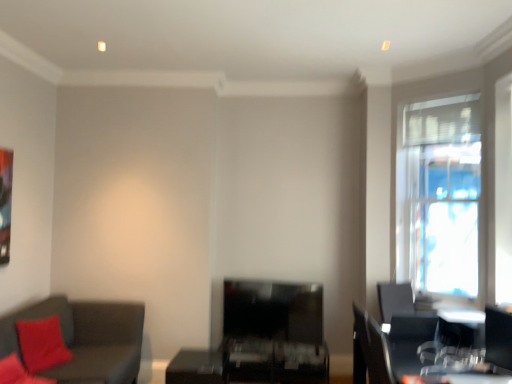
Question: From a real-world perspective, is matte black table at center on dark gray fabric couch at lower left?

Choices:
 (A) yes
 (B) no

Answer: (B)

Question: Is matte black table at center smaller than dark gray fabric couch at lower left?

Choices:
 (A) yes
 (B) no

Answer: (A)

Question: Would you say matte black table at center contains dark gray fabric couch at lower left?

Choices:
 (A) no
 (B) yes

Answer: (A)

Question: From a real-world perspective, is matte black table at center physically below dark gray fabric couch at lower left?

Choices:
 (A) no
 (B) yes

Answer: (B)

Question: Considering the relative sizes of matte black table at center and dark gray fabric couch at lower left in the image provided, is matte black table at center shorter than dark gray fabric couch at lower left?

Choices:
 (A) no
 (B) yes

Answer: (B)

Question: Does matte black table at center turn towards dark gray fabric couch at lower left?

Choices:
 (A) yes
 (B) no

Answer: (B)

Question: From a real-world perspective, is black plastic swivel chair at lower right positioned over dark gray fabric couch at lower left based on gravity?

Choices:
 (A) yes
 (B) no

Answer: (A)

Question: Are black plastic swivel chair at lower right and dark gray fabric couch at lower left far apart?

Choices:
 (A) no
 (B) yes

Answer: (B)

Question: From a real-world perspective, is black plastic swivel chair at lower right located beneath dark gray fabric couch at lower left?

Choices:
 (A) yes
 (B) no

Answer: (B)

Question: Does black plastic swivel chair at lower right lie behind dark gray fabric couch at lower left?

Choices:
 (A) no
 (B) yes

Answer: (B)

Question: From the image's perspective, is black plastic swivel chair at lower right below dark gray fabric couch at lower left?

Choices:
 (A) yes
 (B) no

Answer: (B)

Question: Can you see black plastic swivel chair at lower right touching dark gray fabric couch at lower left?

Choices:
 (A) no
 (B) yes

Answer: (A)

Question: Is dark gray fabric couch at lower left in contact with transparent glass window at right?

Choices:
 (A) yes
 (B) no

Answer: (B)